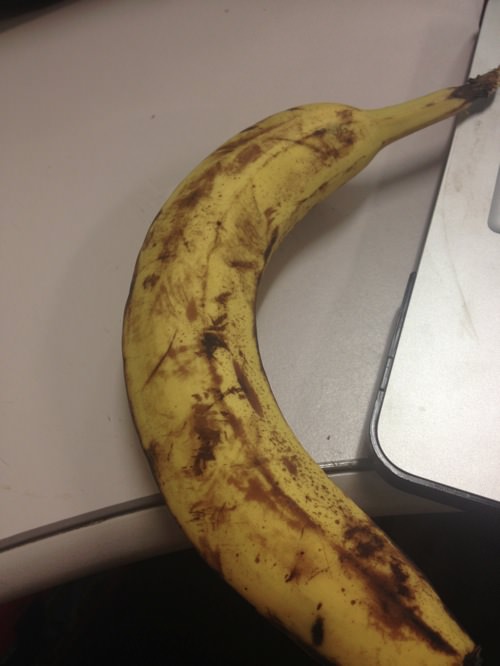
What are the coordinates of `white surface` in the screenshot? It's located at click(467, 314).